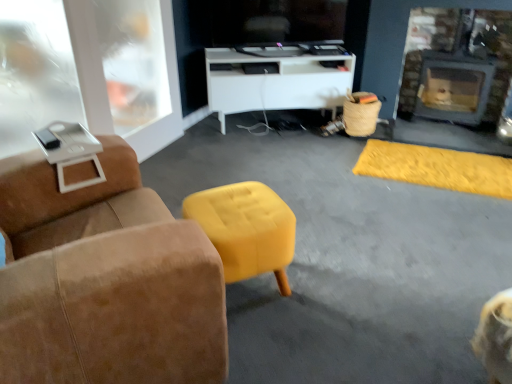
The height and width of the screenshot is (384, 512). Describe the element at coordinates (457, 50) in the screenshot. I see `brick fireplace at right` at that location.

The image size is (512, 384). Describe the element at coordinates (437, 168) in the screenshot. I see `yellow fabric ottoman at center` at that location.

At what (x,y) coordinates should I click in order to perform the action: click on yellow fabric stool at center. Please return your answer as a coordinate pair (x, y). Looking at the image, I should click on (246, 229).

The height and width of the screenshot is (384, 512). I want to click on white glossy cabinet at center, so click(277, 78).

What do you see at coordinates (105, 281) in the screenshot? The image size is (512, 384). I see `suede armchair at left` at bounding box center [105, 281].

I want to click on brick fireplace at right, so click(457, 50).

Visually, is brick fireplace at right positioned to the left or to the right of white glossy cabinet at center?

In the image, brick fireplace at right appears on the right side of white glossy cabinet at center.

Which is in front, brick fireplace at right or white glossy cabinet at center?

brick fireplace at right is in front.

Considering the relative sizes of brick fireplace at right and white glossy cabinet at center in the image provided, is brick fireplace at right wider than white glossy cabinet at center?

No, brick fireplace at right is not wider than white glossy cabinet at center.

At what (x,y) coordinates should I click in order to perform the action: click on fireplace in front of the white glossy cabinet at center. Please return your answer as a coordinate pair (x, y). Looking at the image, I should click on (457, 50).

Which is correct: yellow fabric ottoman at center is inside transparent plastic glass door at upper left, or outside of it?

yellow fabric ottoman at center is not inside transparent plastic glass door at upper left, it's outside.

Is yellow fabric ottoman at center positioned in front of transparent plastic glass door at upper left?

No, the depth of yellow fabric ottoman at center is greater than that of transparent plastic glass door at upper left.

Is there a large distance between yellow fabric ottoman at center and transparent plastic glass door at upper left?

Result: Indeed, yellow fabric ottoman at center is not near transparent plastic glass door at upper left.

Is transparent plastic glass door at upper left looking in the opposite direction of yellow fabric ottoman at center?

transparent plastic glass door at upper left is not turned away from yellow fabric ottoman at center.

From a real-world perspective, is transparent plastic glass door at upper left physically located above or below yellow fabric ottoman at center?

In terms of real-world spatial position, transparent plastic glass door at upper left is above yellow fabric ottoman at center.

What's the angular difference between transparent plastic glass door at upper left and yellow fabric ottoman at center's facing directions?

→ 90.3 degrees.

Is transparent plastic glass door at upper left inside the boundaries of yellow fabric ottoman at center, or outside?

transparent plastic glass door at upper left is outside yellow fabric ottoman at center.

Is yellow fabric stool at center placed right next to transparent plastic glass door at upper left?

No, yellow fabric stool at center is not with transparent plastic glass door at upper left.

The width and height of the screenshot is (512, 384). I want to click on stool located below the transparent plastic glass door at upper left (from the image's perspective), so click(246, 229).

Between yellow fabric stool at center and transparent plastic glass door at upper left, which one has larger width?

Wider between the two is yellow fabric stool at center.

Considering the relative positions of yellow fabric stool at center and transparent plastic glass door at upper left in the image provided, is yellow fabric stool at center to the left of transparent plastic glass door at upper left from the viewer's perspective?

In fact, yellow fabric stool at center is to the right of transparent plastic glass door at upper left.

From the image's perspective, is yellow fabric ottoman at center beneath white glossy cabinet at center?

Yes, from the image's perspective, yellow fabric ottoman at center is below white glossy cabinet at center.

Based on the photo, which is behind, yellow fabric ottoman at center or white glossy cabinet at center?

white glossy cabinet at center.

Which point is more distant from viewer, (374,144) or (219,109)?

The point (219,109) is more distant.

Does yellow fabric ottoman at center have a greater height compared to white glossy cabinet at center?

In fact, yellow fabric ottoman at center may be shorter than white glossy cabinet at center.

Is the surface of transparent plastic glass door at upper left in direct contact with brick fireplace at right?

No, transparent plastic glass door at upper left is not with brick fireplace at right.

From a real-world perspective, is transparent plastic glass door at upper left above or below brick fireplace at right?

Clearly, from a real-world perspective, transparent plastic glass door at upper left is above brick fireplace at right.

Considering the sizes of objects white glossy cabinet at center and transparent plastic glass door at upper left in the image provided, who is bigger, white glossy cabinet at center or transparent plastic glass door at upper left?

white glossy cabinet at center.

In the scene shown: Which is behind, white glossy cabinet at center or transparent plastic glass door at upper left?

Answer: Positioned behind is white glossy cabinet at center.

This screenshot has height=384, width=512. Identify the location of glass door that appears on the left of white glossy cabinet at center. (35, 72).

From the image's perspective, relative to transparent plastic glass door at upper left, is white glossy cabinet at center above or below?

From the image's perspective, white glossy cabinet at center appears above transparent plastic glass door at upper left.

Identify the location of fireplace that appears in front of the white glossy cabinet at center. This screenshot has width=512, height=384. (457, 50).

This screenshot has height=384, width=512. I want to click on flat below the transparent plastic glass door at upper left (from a real-world perspective), so click(x=437, y=168).

From the image, which object appears to be nearer to yellow fabric stool at center, white glossy cabinet at center or transparent plastic glass door at upper left?

transparent plastic glass door at upper left lies closer to yellow fabric stool at center than the other object.

From the image, which object appears to be farther from suede armchair at left, white glossy cabinet at center or brick fireplace at right?

brick fireplace at right is further to suede armchair at left.

Considering their positions, is brick fireplace at right positioned further to yellow fabric stool at center than yellow fabric ottoman at center?

Based on the image, brick fireplace at right appears to be further to yellow fabric stool at center.

Looking at the image, which one is located closer to suede armchair at left, yellow fabric stool at center or yellow fabric ottoman at center?

The object closer to suede armchair at left is yellow fabric stool at center.

Which object lies nearer to the anchor point yellow fabric stool at center, white glossy cabinet at center or yellow fabric ottoman at center?

yellow fabric ottoman at center lies closer to yellow fabric stool at center than the other object.

Estimate the real-world distances between objects in this image. Which object is further from brick fireplace at right, yellow fabric stool at center or white glossy cabinet at center?

yellow fabric stool at center lies further to brick fireplace at right than the other object.

Estimate the real-world distances between objects in this image. Which object is closer to yellow fabric ottoman at center, transparent plastic glass door at upper left or yellow fabric stool at center?

yellow fabric stool at center is closer to yellow fabric ottoman at center.

Considering their positions, is yellow fabric stool at center positioned further to white glossy cabinet at center than brick fireplace at right?

The object further to white glossy cabinet at center is yellow fabric stool at center.

I want to click on table between transparent plastic glass door at upper left and brick fireplace at right in the horizontal direction, so click(x=277, y=78).

At what (x,y) coordinates should I click in order to perform the action: click on stool between transparent plastic glass door at upper left and yellow fabric ottoman at center. Please return your answer as a coordinate pair (x, y). Looking at the image, I should click on (246, 229).

Where is `glass door between suede armchair at left and white glossy cabinet at center from front to back`? Image resolution: width=512 pixels, height=384 pixels. glass door between suede armchair at left and white glossy cabinet at center from front to back is located at coordinates (35, 72).

Locate an element on the screen. The image size is (512, 384). table between transparent plastic glass door at upper left and yellow fabric ottoman at center is located at coordinates (277, 78).